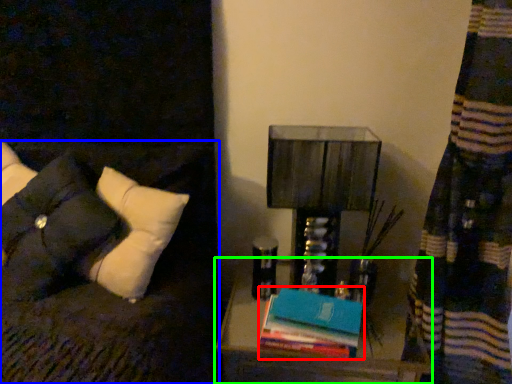
Question: Which object is positioned closest to book (highlighted by a red box)? Select from furniture (highlighted by a blue box) and nightstand (highlighted by a green box).

Choices:
 (A) furniture
 (B) nightstand

Answer: (B)